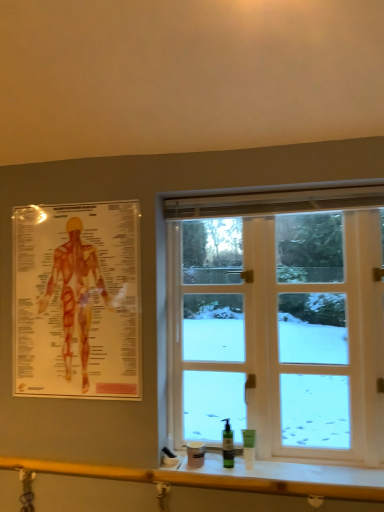
Question: Considering the positions of wooden at lower center and green plastic bottle at lower right, which is counted as the 2th toiletry, starting from the left, in the image, is wooden at lower center wider or thinner than green plastic bottle at lower right, which is counted as the 2th toiletry, starting from the left,?

Choices:
 (A) wide
 (B) thin

Answer: (A)

Question: In the image, is wooden at lower center on the left side or the right side of green plastic bottle at lower right, which is counted as the 2th toiletry, starting from the left?

Choices:
 (A) right
 (B) left

Answer: (B)

Question: Which object is positioned closest to the green plastic bottle at lower right, which appears as the 1th toiletry when viewed from the right?

Choices:
 (A) transparent plastic poster at upper left
 (B) white glass window at center
 (C) green matte pump bottle at lower center, arranged as the first toiletry when viewed from the left
 (D) wooden at lower center

Answer: (C)

Question: Which object is the farthest from the white glass window at center?

Choices:
 (A) green matte pump bottle at lower center, arranged as the first toiletry when viewed from the left
 (B) transparent plastic poster at upper left
 (C) green plastic bottle at lower right, which is counted as the 2th toiletry, starting from the left
 (D) wooden at lower center

Answer: (B)